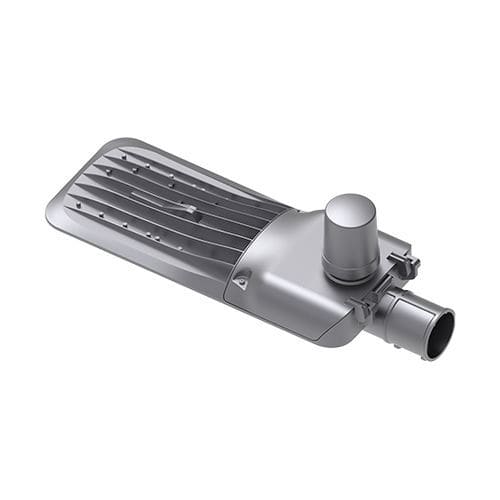
Locate an element on the screen. The width and height of the screenshot is (500, 500). space to right of mirror is located at coordinates coord(12,191).